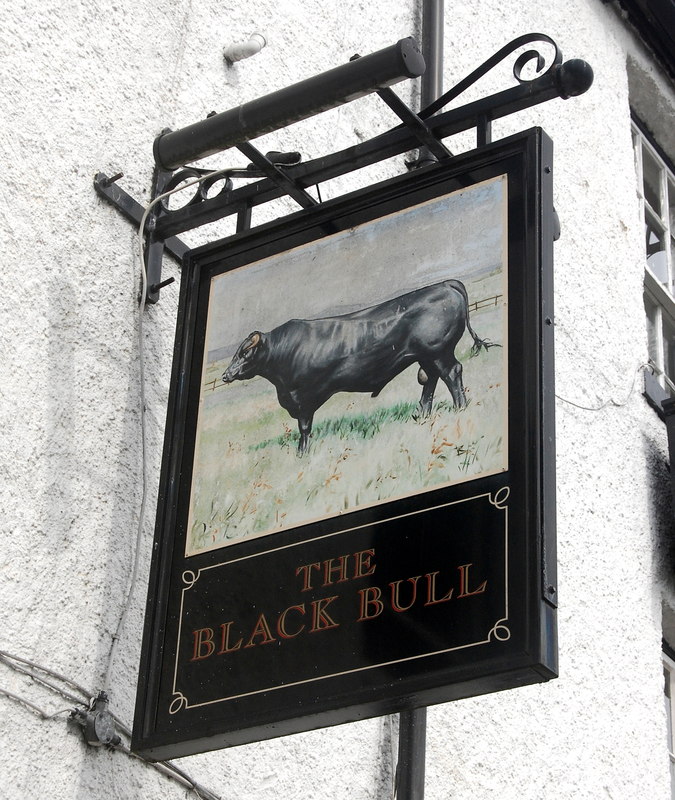
Where is `bracket`? bracket is located at coordinates (275, 114).